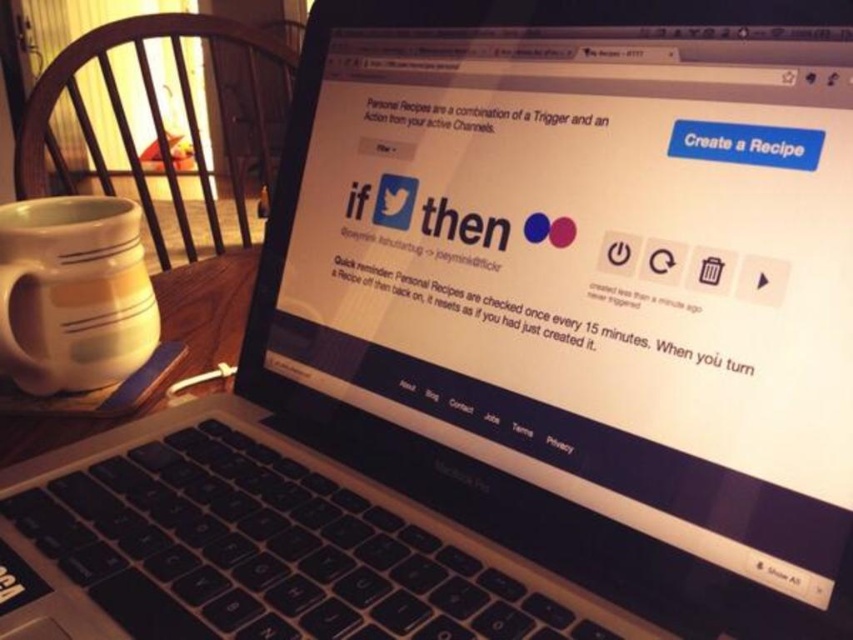
You are a graphic designer working on a layout for the IFTTT website. You need to place a new button between the two points on the screen, point (16, 342) and point (212, 262). Which point should the button be closer to if you want it to appear more prominent to the viewer?

The button should be placed closer to point (16, 342) because it is closer to the viewer than point (212, 262), making it more prominent.

You are organizing a coffee tasting event and need to place a white matte mug at left on a stable surface. Can the white ceramic table at lower left support the mug?

The white matte mug at left is positioned over white ceramic table at lower left, indicating that the table can support the mug.

You have a white matte mug at left and a white ceramic table at lower left in front of you. Which object is wider?

The white ceramic table at lower left is wider than the white matte mug at left.